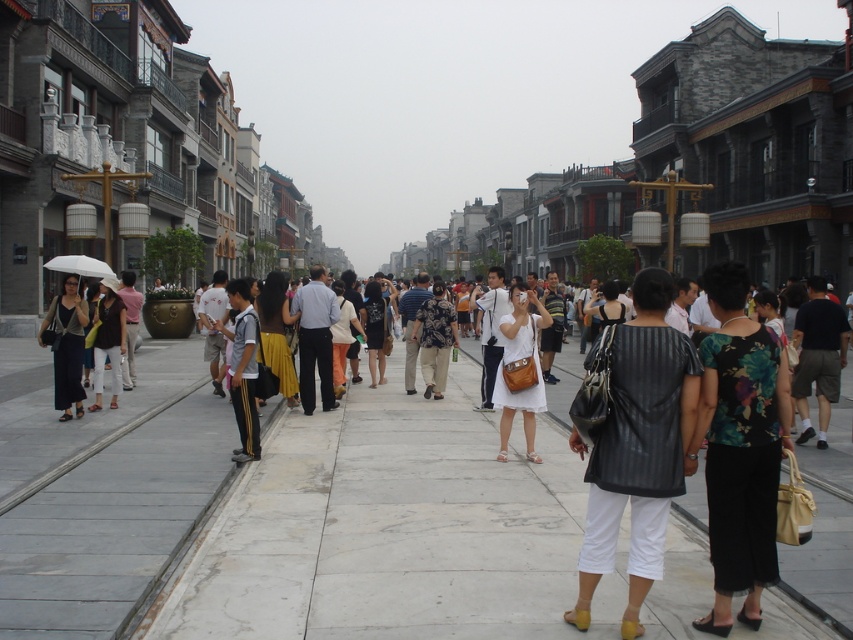
Question: Can you confirm if floral fabric blouse at center is positioned above gray fabric shirt at center?

Choices:
 (A) yes
 (B) no

Answer: (B)

Question: Estimate the real-world distances between objects in this image. Which object is farther from the black leather vest at center?

Choices:
 (A) floral fabric dress at center
 (B) floral fabric blouse at center
 (C) white marble pavement at center

Answer: (A)

Question: Observing the image, what is the correct spatial positioning of matte black dress at left in reference to floral fabric dress at center?

Choices:
 (A) below
 (B) above

Answer: (B)

Question: Where is white matte dress at center located in relation to gray fabric shirt at center in the image?

Choices:
 (A) above
 (B) below

Answer: (B)

Question: Among these points, which one is farthest from the camera?

Choices:
 (A) (241, 438)
 (B) (107, 339)
 (C) (665, 358)
 (D) (450, 323)

Answer: (D)

Question: Estimate the real-world distances between objects in this image. Which object is closer to the white matte umbrella at left?

Choices:
 (A) white marble pavement at center
 (B) floral fabric dress at center

Answer: (A)